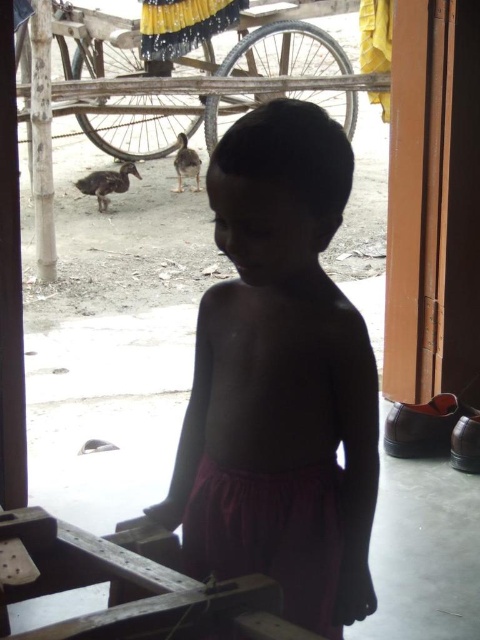
Question: Among these points, which one is farthest from the camera?

Choices:
 (A) (277, 132)
 (B) (190, 163)

Answer: (B)

Question: Among these points, which one is nearest to the camera?

Choices:
 (A) (191, 148)
 (B) (283, 554)
 (C) (107, 170)

Answer: (B)

Question: Is dark skin/smooth skin/child at center wider than brown fuzzy duckling at center?

Choices:
 (A) no
 (B) yes

Answer: (B)

Question: Is matte purple skirt at center behind brown matte duck at lower left?

Choices:
 (A) yes
 (B) no

Answer: (B)

Question: Which is farther from the dark skin/smooth skin/child at center?

Choices:
 (A) matte purple skirt at center
 (B) brown fuzzy duckling at center

Answer: (B)

Question: Is matte purple skirt at center below brown fuzzy duckling at center?

Choices:
 (A) no
 (B) yes

Answer: (B)